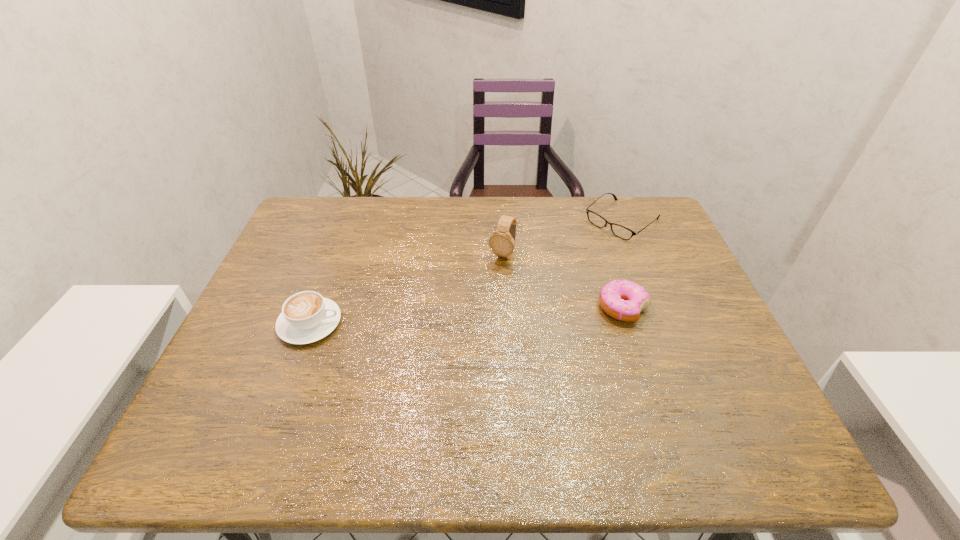
You are a GUI agent. You are given a task and a screenshot of the screen. Output one action in this format:
    pyautogui.click(x=<x>, y=<y>)
    Task: Click on the vacant space at the near edge of the desktop
    The image size is (960, 540).
    Given the screenshot: What is the action you would take?
    tap(621, 405)

Find the location of a particular element. vacant space at the left edge is located at coordinates (302, 288).

In the image, there is a desktop. Identify the location of free region at the right edge. (637, 261).

This screenshot has height=540, width=960. Find the location of `vacant space at the far left corner of the desktop`. vacant space at the far left corner of the desktop is located at coordinates [x=292, y=225].

Image resolution: width=960 pixels, height=540 pixels. In the image, there is a desktop. Find the location of `vacant space at the near right corner`. vacant space at the near right corner is located at coordinates (750, 395).

At what (x,y) coordinates should I click in order to perform the action: click on unoccupied area between the third tallest object and the second tallest object. Please return your answer as a coordinate pair (x, y). The height and width of the screenshot is (540, 960). Looking at the image, I should click on (467, 315).

At what (x,y) coordinates should I click in order to perform the action: click on free space that is in between the second tallest object and the spectacles. Please return your answer as a coordinate pair (x, y). This screenshot has width=960, height=540. Looking at the image, I should click on (466, 272).

Locate an element on the screen. unoccupied position between the tallest object and the spectacles is located at coordinates (562, 238).

Locate an element on the screen. free space that is in between the shortest object and the leftmost object is located at coordinates (466, 272).

Where is `free space between the second shortest object and the watch`? The width and height of the screenshot is (960, 540). free space between the second shortest object and the watch is located at coordinates coord(563,281).